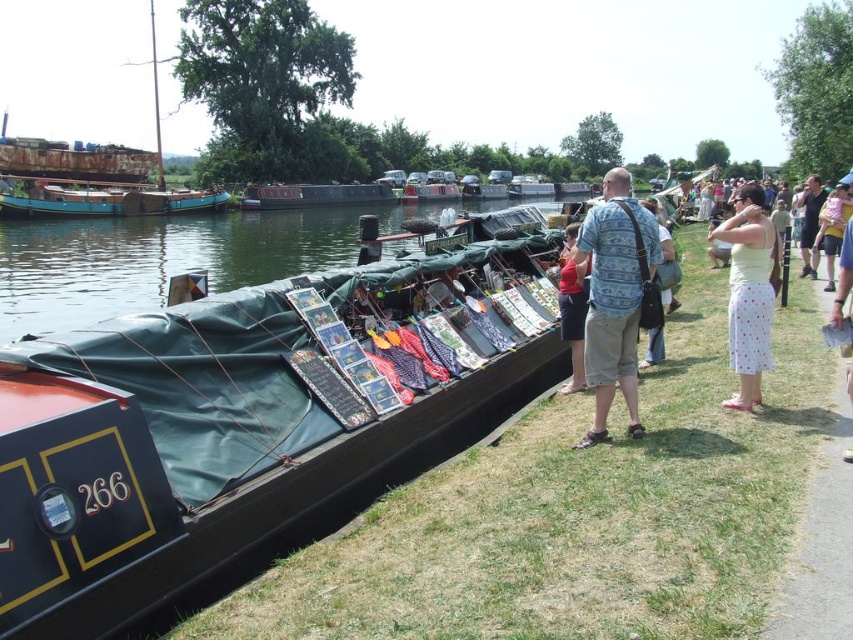
Question: Which object appears closest to the camera in this image?

Choices:
 (A) blue fabric bag at center
 (B) light pink fabric at upper right
 (C) rusty metal boat at upper left

Answer: (A)

Question: Is light pink fabric at upper right further to the viewer compared to matte black boat at center?

Choices:
 (A) no
 (B) yes

Answer: (A)

Question: Does green canvas boat at center appear on the left side of light pink fabric at upper right?

Choices:
 (A) yes
 (B) no

Answer: (A)

Question: Does white dotted dress at right have a lesser width compared to matte black boat at center?

Choices:
 (A) no
 (B) yes

Answer: (A)

Question: Which point is farther from the camera taking this photo?

Choices:
 (A) (659, 241)
 (B) (576, 257)
 (C) (421, 196)

Answer: (C)

Question: Which point is farther to the camera?

Choices:
 (A) rusty metal boat at upper left
 (B) light pink fabric at upper right
 (C) matte black boat at center
 (D) green tarpaulin boat at center

Answer: (C)